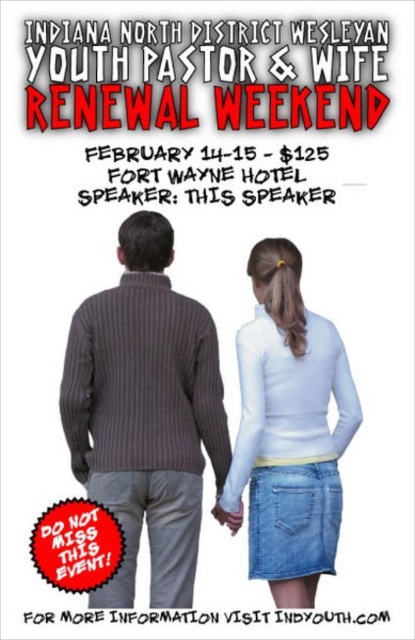
Can you confirm if black paper text at center is positioned to the right of white matte hand at center?

In fact, black paper text at center is to the left of white matte hand at center.

What do you see at coordinates (205, 177) in the screenshot? Image resolution: width=415 pixels, height=640 pixels. I see `black paper text at center` at bounding box center [205, 177].

Image resolution: width=415 pixels, height=640 pixels. I want to click on black paper text at center, so click(205, 177).

Locate an element on the screen. black paper text at center is located at coordinates (205, 177).

Who is more distant from viewer, [270,166] or [121,620]?

Positioned behind is point [270,166].

Does black paper text at center have a larger size compared to white paper at center?

Actually, black paper text at center might be smaller than white paper at center.

Is point (290, 186) farther from viewer compared to point (305, 611)?

Yes, point (290, 186) is behind point (305, 611).

This screenshot has width=415, height=640. I want to click on black paper text at center, so click(x=205, y=177).

Consider the image. Between ribbed brown sweater at center and black paper text at center, which one has less height?

black paper text at center is shorter.

Who is more distant from viewer, (204, 371) or (156, 163)?

The point (156, 163) is behind.

Where is `ribbed brown sweater at center`? This screenshot has height=640, width=415. ribbed brown sweater at center is located at coordinates pos(146,412).